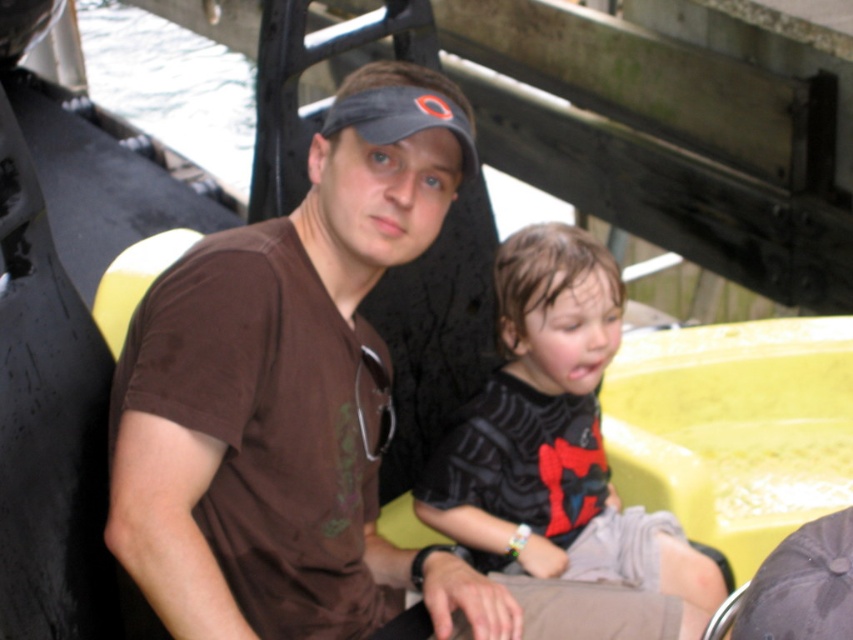
Who is lower down, brown matte t-shirt at center or black matte shirt at center?

Positioned lower is black matte shirt at center.

Which is more to the left, brown matte t-shirt at center or black matte shirt at center?

Positioned to the left is brown matte t-shirt at center.

Is point (184, 275) positioned behind point (573, 513)?

No, (184, 275) is in front of (573, 513).

Identify the location of brown matte t-shirt at center. (183, 442).